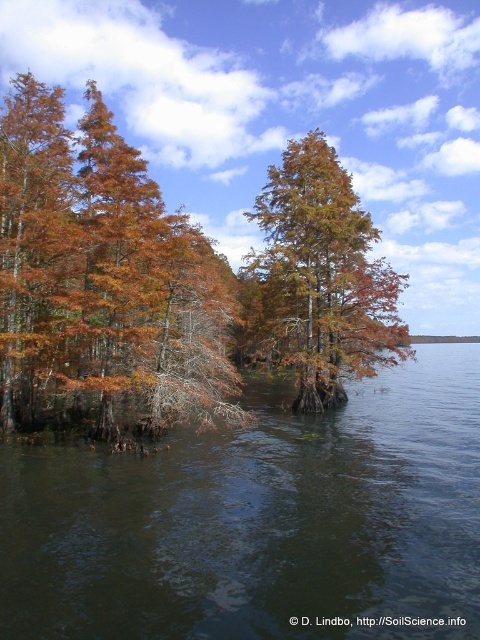
Question: Can you confirm if brown murky water at lower left is positioned below orange matte tree at center?

Choices:
 (A) no
 (B) yes

Answer: (B)

Question: Among these objects, which one is farthest from the camera?

Choices:
 (A) orange matte tree at center
 (B) brown murky water at lower left

Answer: (A)

Question: Does orange-brown bark tree at upper left appear on the left side of orange matte tree at center?

Choices:
 (A) yes
 (B) no

Answer: (A)

Question: Based on their relative distances, which object is nearer to the brown murky water at lower left?

Choices:
 (A) orange-brown bark tree at upper left
 (B) orange matte tree at center

Answer: (A)

Question: In this image, where is brown murky water at lower left located relative to orange matte tree at center?

Choices:
 (A) below
 (B) above

Answer: (A)

Question: Which is farther from the orange matte tree at center?

Choices:
 (A) brown murky water at lower left
 (B) orange-brown bark tree at upper left

Answer: (A)